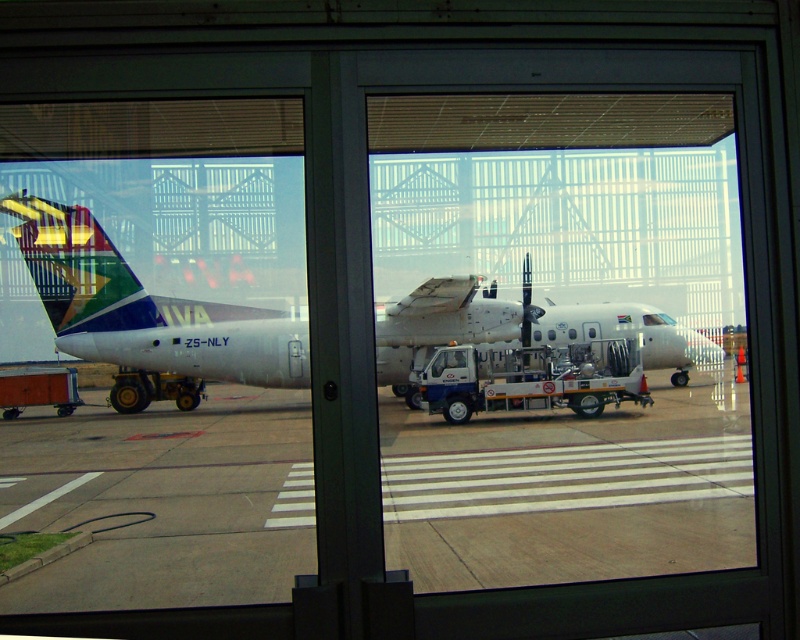
You are a delivery person trying to enter the airport terminal through the transparent glass door at center. The white matte airplane at center is blocking your path. Can you walk around the airplane to reach the door?

The transparent glass door at center occupies less space than the white matte airplane at center, so the airplane is larger and might block the path. However, since the door is at the center, you might need to go around the airplane to reach it. But the description does not provide information about the exact positioning or distance between them, so it is unclear if there is enough space to navigate around.

You are a passenger trying to board the South African Airways aircraft ZS_NLY. The transparent glass door at center is the entrance. Can you walk directly to the aircraft from your current position without crossing any obstacles?

The transparent glass door at center is located at point (606, 540). Since there are no obstacles mentioned in the scene description between your current position and the door, you can walk directly to the aircraft through the transparent glass door at center.